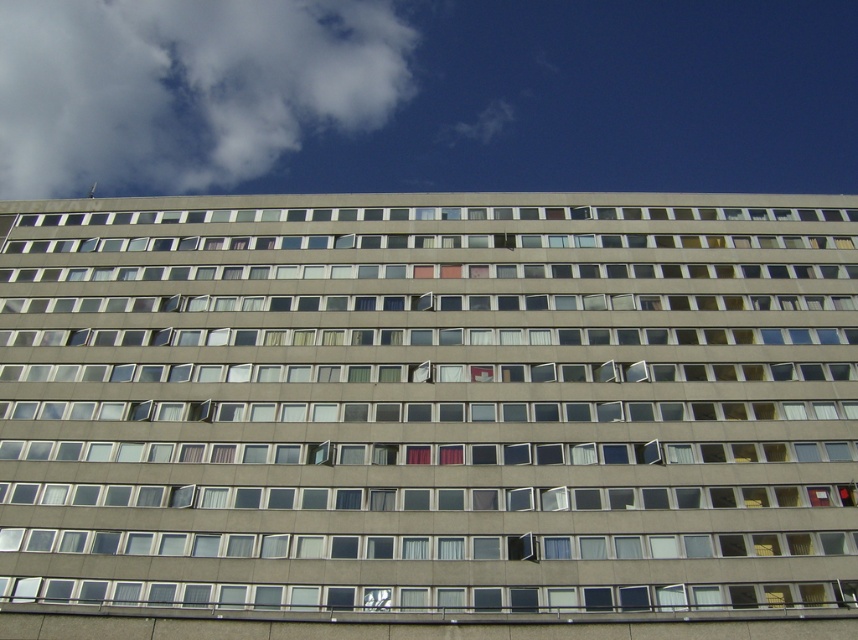
Is matte gray window at center above white fluffy cloud at upper left?

Actually, matte gray window at center is below white fluffy cloud at upper left.

Find the location of a particular element. The height and width of the screenshot is (640, 858). matte gray window at center is located at coordinates (429, 403).